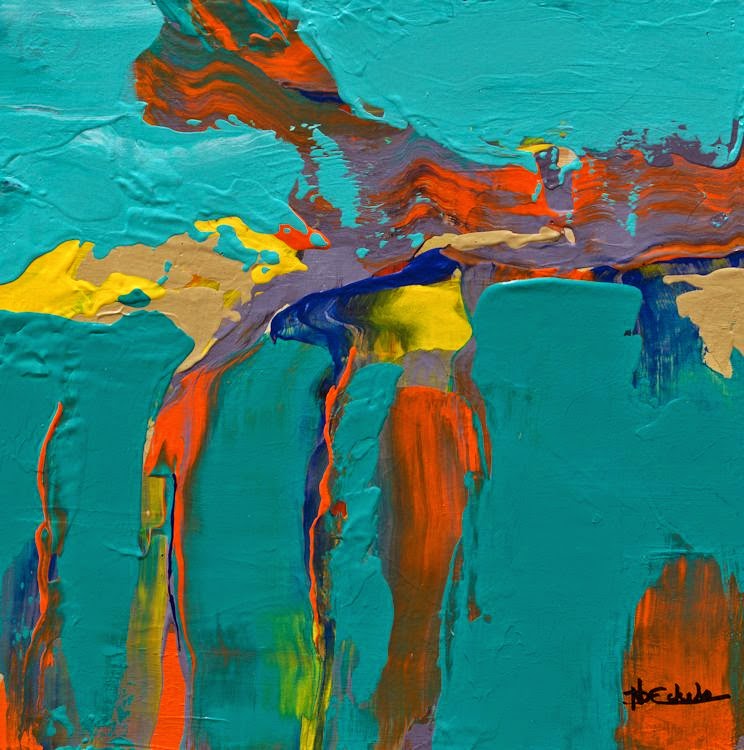
Image resolution: width=744 pixels, height=750 pixels. Find the location of `deep blue paint`. deep blue paint is located at coordinates (530, 283).